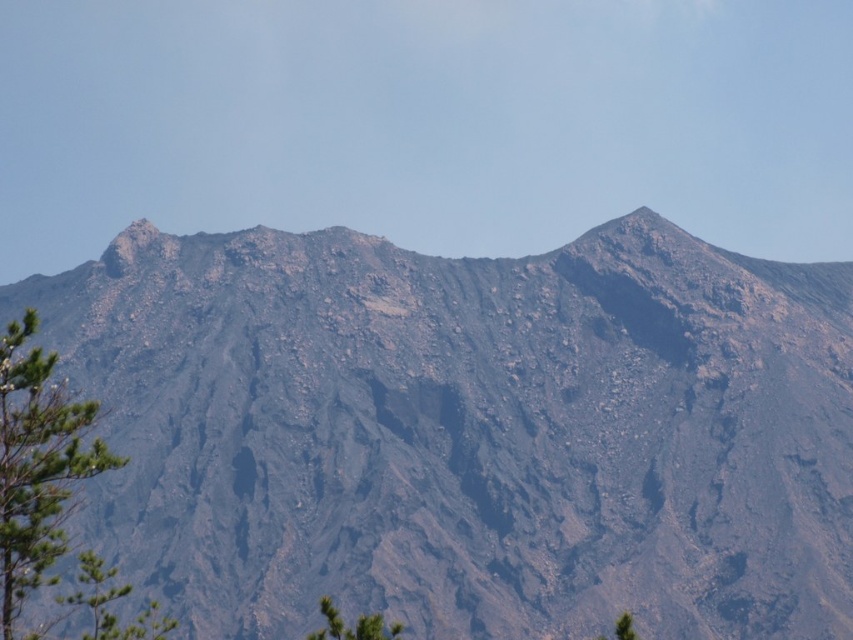
Question: Which of the following is the farthest from the observer?

Choices:
 (A) (4, 358)
 (B) (379, 637)
 (C) (212, 336)

Answer: (C)

Question: Is green leafy tree at left wider than green leafy tree at lower left?

Choices:
 (A) no
 (B) yes

Answer: (B)

Question: Where is green leafy tree at left located in relation to green leafy tree at lower left in the image?

Choices:
 (A) left
 (B) right

Answer: (A)

Question: Does green leafy tree at left have a greater width compared to green leafy tree at lower left?

Choices:
 (A) yes
 (B) no

Answer: (A)

Question: Which point appears closest to the camera in this image?

Choices:
 (A) (625, 285)
 (B) (0, 579)

Answer: (B)

Question: Based on their relative distances, which object is farther from the green leafy tree at left?

Choices:
 (A) green leafy tree at lower left
 (B) rugged stone mountain at center

Answer: (B)